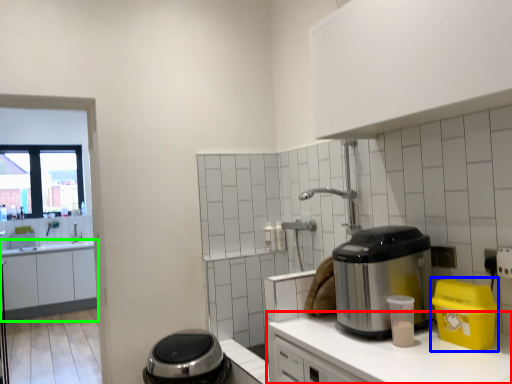
Question: Estimate the real-world distances between objects in this image. Which object is farther from countertop (highlighted by a red box), appliance (highlighted by a blue box) or cabinetry (highlighted by a green box)?

Choices:
 (A) appliance
 (B) cabinetry

Answer: (B)